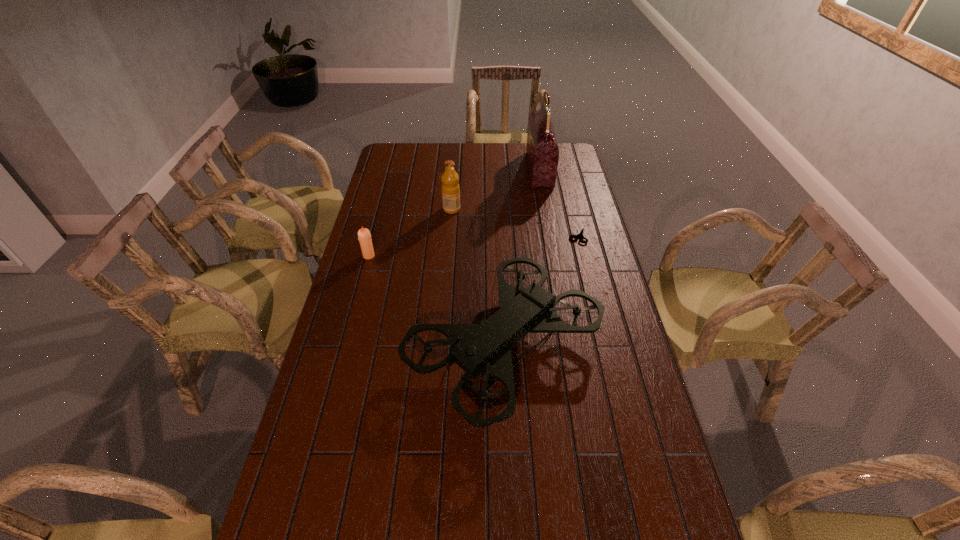
This screenshot has height=540, width=960. Identify the location of the tallest object. (x=542, y=151).

Identify the location of handbag. (542, 151).

Where is `the second tallest object`? This screenshot has height=540, width=960. the second tallest object is located at coordinates (484, 349).

Identify the location of drone. pyautogui.click(x=484, y=349).

Where is `the third shortest object`? Image resolution: width=960 pixels, height=540 pixels. the third shortest object is located at coordinates (450, 188).

Locate an element on the screen. the fourth nearest object is located at coordinates (450, 188).

Find the location of `the second shortest object`. the second shortest object is located at coordinates (364, 236).

The image size is (960, 540). I want to click on candle, so click(364, 236).

Find the location of a particular element. The width and height of the screenshot is (960, 540). the third nearest object is located at coordinates (580, 234).

At what (x,y) coordinates should I click in order to perform the action: click on the shortest object. Please return your answer as a coordinate pair (x, y). Looking at the image, I should click on (580, 234).